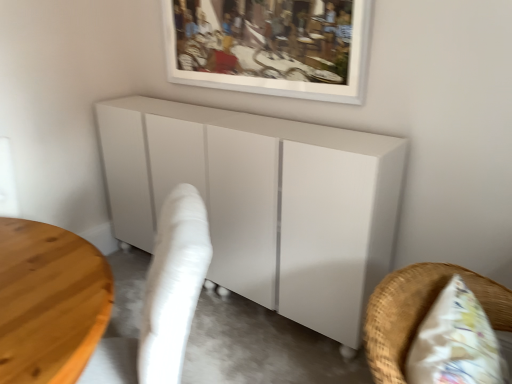
This screenshot has height=384, width=512. Describe the element at coordinates (263, 202) in the screenshot. I see `white glossy cabinet at center, which ranks as the 2th furniture in front-to-back order` at that location.

I want to click on white fabric swivel chair at lower left, so click(x=162, y=300).

Consider the image. Would you say white glossy cabinet at center, which ranks as the 2th furniture in front-to-back order, is to the left or to the right of white fabric swivel chair at lower left in the picture?

In the image, white glossy cabinet at center, which ranks as the 2th furniture in front-to-back order, appears on the right side of white fabric swivel chair at lower left.

Can you confirm if white glossy cabinet at center, the 1th furniture positioned from the back, is taller than white fabric swivel chair at lower left?

Yes, white glossy cabinet at center, the 1th furniture positioned from the back, is taller than white fabric swivel chair at lower left.

Is white glossy cabinet at center, which ranks as the 2th furniture in front-to-back order, turned away from white fabric swivel chair at lower left?

No, white glossy cabinet at center, which ranks as the 2th furniture in front-to-back order, is not facing away from white fabric swivel chair at lower left.

Find the location of a particular element. The image size is (512, 384). furniture behind the white fabric swivel chair at lower left is located at coordinates pyautogui.click(x=263, y=202).

Could you tell me if white fabric swivel chair at lower left is facing white glossy cabinet at center, which ranks as the 2th furniture in front-to-back order?

No, white fabric swivel chair at lower left is not turned towards white glossy cabinet at center, which ranks as the 2th furniture in front-to-back order.

Considering the positions of objects white fabric swivel chair at lower left and white glossy cabinet at center, the 1th furniture positioned from the back, in the image provided, who is in front, white fabric swivel chair at lower left or white glossy cabinet at center, the 1th furniture positioned from the back,?

Positioned in front is white fabric swivel chair at lower left.

Considering the relative positions of white fabric swivel chair at lower left and white glossy cabinet at center, the 1th furniture positioned from the back, in the image provided, is white fabric swivel chair at lower left to the left of white glossy cabinet at center, the 1th furniture positioned from the back, from the viewer's perspective?

Yes, white fabric swivel chair at lower left is to the left of white glossy cabinet at center, the 1th furniture positioned from the back.

Is point (151, 374) positioned in front of point (395, 370)?

No, it is not.

Considering the positions of objects white fabric swivel chair at lower left and white wicker chair at lower right, the first furniture from the front, in the image provided, who is behind, white fabric swivel chair at lower left or white wicker chair at lower right, the first furniture from the front,?

Positioned behind is white fabric swivel chair at lower left.

Considering the sizes of white fabric swivel chair at lower left and white wicker chair at lower right, the first furniture from the front, in the image, is white fabric swivel chair at lower left bigger or smaller than white wicker chair at lower right, the first furniture from the front,?

white fabric swivel chair at lower left is bigger than white wicker chair at lower right, the first furniture from the front.

Which object is positioned more to the left, white fabric swivel chair at lower left or white wicker chair at lower right, positioned as the 2th furniture in back-to-front order?

From the viewer's perspective, white fabric swivel chair at lower left appears more on the left side.

From the image's perspective, relative to white matte picture frame at upper center, is white glossy cabinet at center, the 1th furniture positioned from the back, above or below?

From the image's perspective, white glossy cabinet at center, the 1th furniture positioned from the back, appears below white matte picture frame at upper center.

The height and width of the screenshot is (384, 512). I want to click on picture frame that is on the right side of white glossy cabinet at center, the 1th furniture positioned from the back, so click(x=270, y=47).

Could you tell me if white glossy cabinet at center, the 1th furniture positioned from the back, is turned towards white matte picture frame at upper center?

No, white glossy cabinet at center, the 1th furniture positioned from the back, is not turned towards white matte picture frame at upper center.

Considering the points (262, 227) and (280, 33), which point is behind, point (262, 227) or point (280, 33)?

The point (280, 33) is farther.

Based on the photo, from a real-world perspective, which object rests below the other?

white glossy cabinet at center, which ranks as the 2th furniture in front-to-back order, from a real-world perspective.

Which of these two, white glossy cabinet at center, the 1th furniture positioned from the back, or white wicker chair at lower right, positioned as the 2th furniture in back-to-front order, is smaller?

white wicker chair at lower right, positioned as the 2th furniture in back-to-front order, is smaller.

Between white glossy cabinet at center, the 1th furniture positioned from the back, and white wicker chair at lower right, the first furniture from the front, which one has larger width?

white glossy cabinet at center, the 1th furniture positioned from the back, is wider.

Is white glossy cabinet at center, the 1th furniture positioned from the back, facing away from white wicker chair at lower right, the first furniture from the front?

No.

Considering the relative sizes of white wicker chair at lower right, the first furniture from the front, and white fabric swivel chair at lower left in the image provided, is white wicker chair at lower right, the first furniture from the front, bigger than white fabric swivel chair at lower left?

Actually, white wicker chair at lower right, the first furniture from the front, might be smaller than white fabric swivel chair at lower left.

Considering the points (495, 301) and (162, 277), which point is behind, point (495, 301) or point (162, 277)?

The point (495, 301) is more distant.

Relative to white fabric swivel chair at lower left, is white wicker chair at lower right, positioned as the 2th furniture in back-to-front order, in front or behind?

white wicker chair at lower right, positioned as the 2th furniture in back-to-front order, is positioned closer to the viewer than white fabric swivel chair at lower left.

Who is taller, white matte picture frame at upper center or white fabric swivel chair at lower left?

Standing taller between the two is white fabric swivel chair at lower left.

Does white matte picture frame at upper center have a larger size compared to white fabric swivel chair at lower left?

No.

From a real-world perspective, does white matte picture frame at upper center sit lower than white fabric swivel chair at lower left?

No.

Starting from the white fabric swivel chair at lower left, which furniture is the 1st one to the right? Please provide its 2D coordinates.

[(263, 202)]

This screenshot has height=384, width=512. Identify the location of furniture behind the white fabric swivel chair at lower left. (263, 202).

In the scene shown: Estimate the real-world distances between objects in this image. Which object is further from white matte picture frame at upper center, white glossy cabinet at center, the 1th furniture positioned from the back, or white fabric swivel chair at lower left?

white fabric swivel chair at lower left is further to white matte picture frame at upper center.

Based on their spatial positions, is white fabric swivel chair at lower left or white matte picture frame at upper center closer to white wicker chair at lower right, the first furniture from the front?

white fabric swivel chair at lower left lies closer to white wicker chair at lower right, the first furniture from the front, than the other object.

From the image, which object appears to be nearer to white fabric swivel chair at lower left, white glossy cabinet at center, the 1th furniture positioned from the back, or white matte picture frame at upper center?

Among the two, white glossy cabinet at center, the 1th furniture positioned from the back, is located nearer to white fabric swivel chair at lower left.

Based on their spatial positions, is white fabric swivel chair at lower left or white matte picture frame at upper center further from white glossy cabinet at center, which ranks as the 2th furniture in front-to-back order?

white fabric swivel chair at lower left lies further to white glossy cabinet at center, which ranks as the 2th furniture in front-to-back order, than the other object.

Based on their spatial positions, is white glossy cabinet at center, which ranks as the 2th furniture in front-to-back order, or white wicker chair at lower right, the first furniture from the front, further from white fabric swivel chair at lower left?

white glossy cabinet at center, which ranks as the 2th furniture in front-to-back order, is positioned further to the anchor white fabric swivel chair at lower left.

From the image, which object appears to be nearer to white glossy cabinet at center, the 1th furniture positioned from the back, white wicker chair at lower right, positioned as the 2th furniture in back-to-front order, or white fabric swivel chair at lower left?

The object closer to white glossy cabinet at center, the 1th furniture positioned from the back, is white fabric swivel chair at lower left.

Based on their spatial positions, is white glossy cabinet at center, which ranks as the 2th furniture in front-to-back order, or white matte picture frame at upper center closer to white wicker chair at lower right, positioned as the 2th furniture in back-to-front order?

Among the two, white glossy cabinet at center, which ranks as the 2th furniture in front-to-back order, is located nearer to white wicker chair at lower right, positioned as the 2th furniture in back-to-front order.

Considering their positions, is white wicker chair at lower right, positioned as the 2th furniture in back-to-front order, positioned closer to white matte picture frame at upper center than white fabric swivel chair at lower left?

white fabric swivel chair at lower left lies closer to white matte picture frame at upper center than the other object.

Identify the location of furniture between white fabric swivel chair at lower left and white wicker chair at lower right, the first furniture from the front, in the horizontal direction. This screenshot has height=384, width=512. (263, 202).

I want to click on furniture between white matte picture frame at upper center and white wicker chair at lower right, positioned as the 2th furniture in back-to-front order, from top to bottom, so click(263, 202).